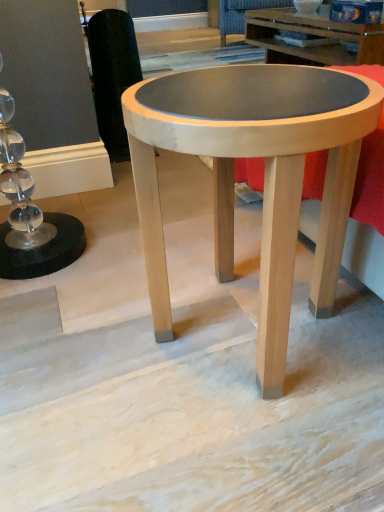
You are a GUI agent. You are given a task and a screenshot of the screen. Output one action in this format:
    pyautogui.click(x=<x>, y=<y>)
    Task: Click on the free space in front of matte wood coffee table at center
    
    Given the screenshot: What is the action you would take?
    pyautogui.click(x=247, y=449)